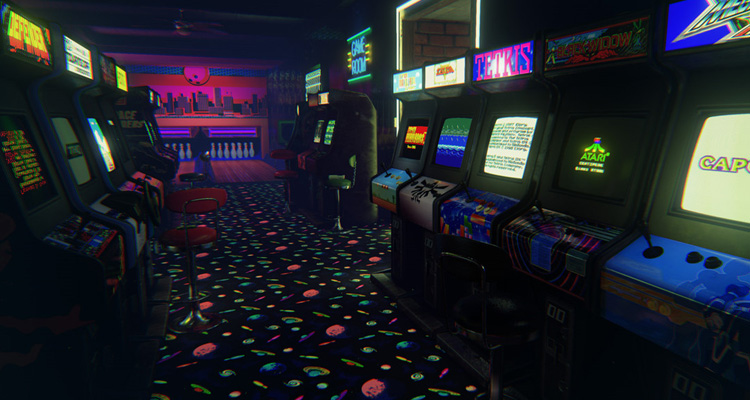
You are a GUI agent. You are given a task and a screenshot of the screen. Output one action in this format:
    pyautogui.click(x=<x>, y=<y>)
    Task: Click on the arcade cabinet
    
    Given the screenshot: What is the action you would take?
    [x=698, y=27], [x=600, y=30], [x=513, y=50], [x=430, y=75], [x=409, y=81], [x=332, y=95], [x=112, y=75], [x=79, y=70], [x=152, y=99]